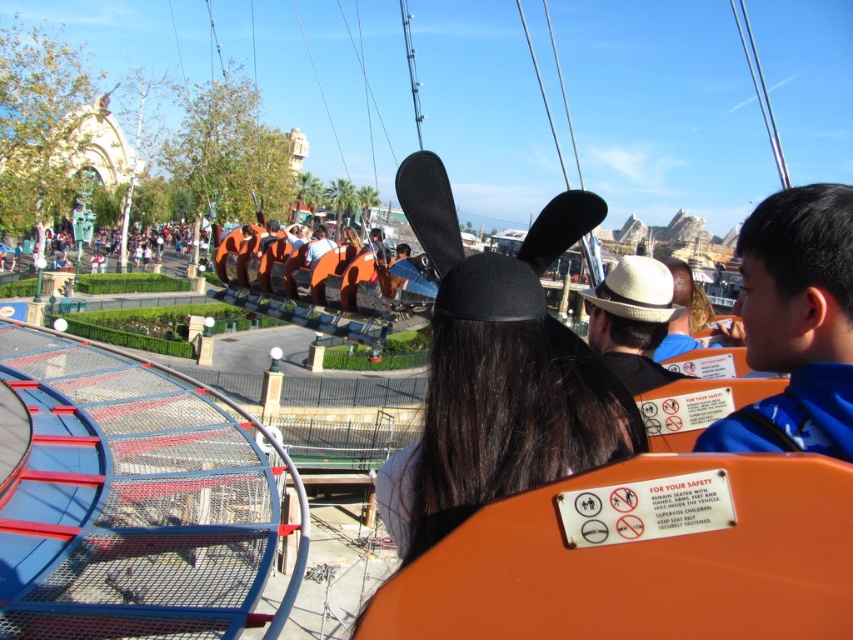
Can you confirm if black fabric hat at upper center is smaller than orange fabric shirt at center?

Indeed, black fabric hat at upper center has a smaller size compared to orange fabric shirt at center.

What are the coordinates of `black fabric hat at upper center` in the screenshot? It's located at (795, 324).

Can you confirm if black fabric hat at upper center is positioned to the right of orange fabric crowd at center?

Yes, black fabric hat at upper center is to the right of orange fabric crowd at center.

Can you confirm if black fabric hat at upper center is taller than orange fabric crowd at center?

Yes, black fabric hat at upper center is taller than orange fabric crowd at center.

Where is `black fabric hat at upper center`? This screenshot has height=640, width=853. black fabric hat at upper center is located at coordinates (795, 324).

What are the coordinates of `black fabric hat at upper center` in the screenshot? It's located at (795, 324).

Is black fabric hat at center in front of orange fabric shirt at center?

Yes, black fabric hat at center is in front of orange fabric shirt at center.

Who is positioned more to the left, black fabric hat at center or orange fabric shirt at center?

Positioned to the left is orange fabric shirt at center.

Is point (473, 483) more distant than point (316, 252)?

No, (473, 483) is in front of (316, 252).

Where is `black fabric hat at center`? This screenshot has width=853, height=640. black fabric hat at center is located at coordinates (498, 406).